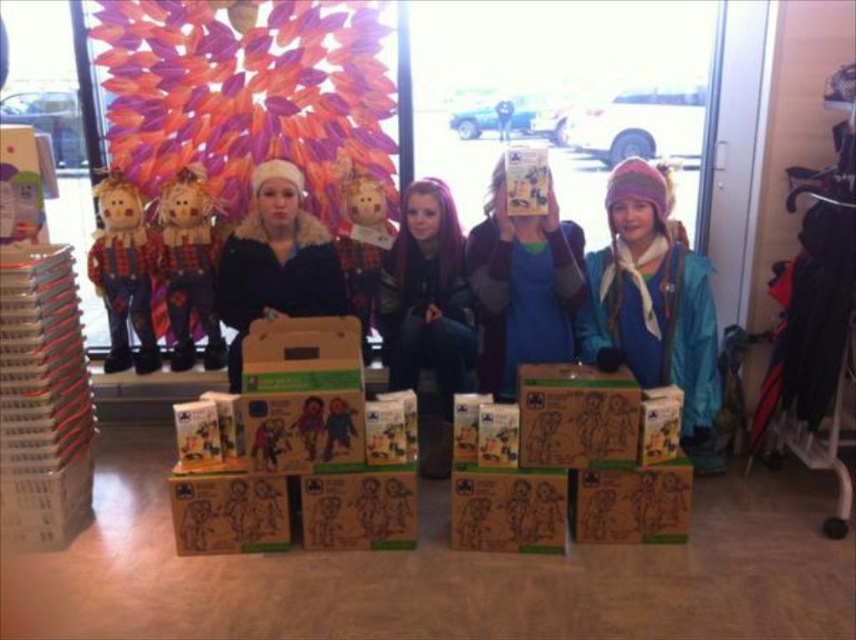
Where is `dark purple hair at center`? dark purple hair at center is located at coordinates (428, 307).

Is dark purple hair at center further to the viewer compared to plush fabric scarecrow at left?

No, dark purple hair at center is closer to the viewer.

Between point (393, 268) and point (104, 250), which one is positioned in front?

Positioned in front is point (104, 250).

Locate an element on the screen. dark purple hair at center is located at coordinates (428, 307).

This screenshot has width=856, height=640. What do you see at coordinates (276, 260) in the screenshot?
I see `matte black jacket at center` at bounding box center [276, 260].

Between point (224, 243) and point (107, 253), which one is positioned behind?

The point (224, 243) is behind.

What are the coordinates of `matte black jacket at center` in the screenshot? It's located at (276, 260).

Which is more to the left, blue fleece jacket at center or wooden scarecrow at center?

From the viewer's perspective, wooden scarecrow at center appears more on the left side.

Image resolution: width=856 pixels, height=640 pixels. What are the coordinates of `blue fleece jacket at center` in the screenshot? It's located at (651, 300).

Locate an element on the screen. blue fleece jacket at center is located at coordinates (651, 300).